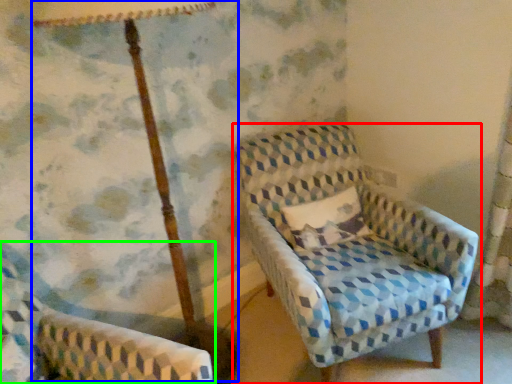
Question: Estimate the real-world distances between objects in this image. Which object is farther from chair (highlighted by a red box), table lamp (highlighted by a blue box) or chair (highlighted by a green box)?

Choices:
 (A) table lamp
 (B) chair

Answer: (B)